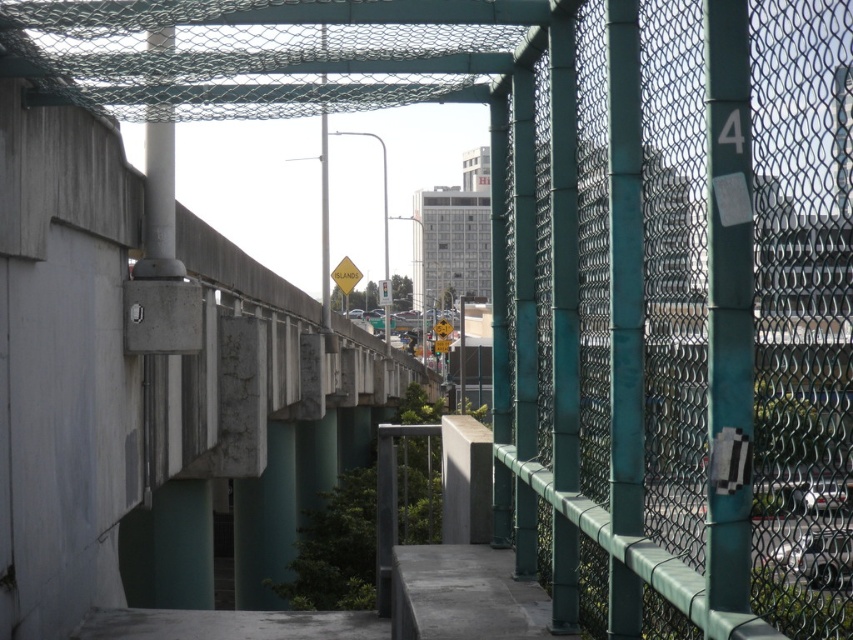
Who is lower down, teal chain-link fence at center or yellow reflective plastic at center?

teal chain-link fence at center is below.

Is teal chain-link fence at center shorter than yellow reflective plastic at center?

Yes.

Between point (614, 324) and point (350, 272), which one is positioned behind?

The point (350, 272) is behind.

Where is `teal chain-link fence at center`? The height and width of the screenshot is (640, 853). teal chain-link fence at center is located at coordinates (676, 314).